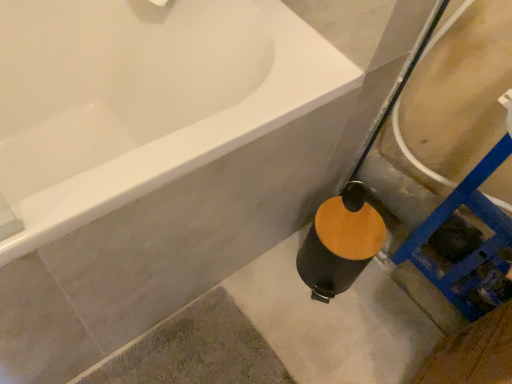
What is the approximate height of white glossy bathtub at upper left?

24.77 inches.

The image size is (512, 384). What do you see at coordinates (142, 99) in the screenshot?
I see `white glossy bathtub at upper left` at bounding box center [142, 99].

Where is `white glossy bathtub at upper left`? This screenshot has height=384, width=512. white glossy bathtub at upper left is located at coordinates 142,99.

You are a GUI agent. You are given a task and a screenshot of the screen. Output one action in this format:
    pyautogui.click(x=<x>, y=<y>)
    Task: Click on the white glossy bathtub at upper left
    The width and height of the screenshot is (512, 384).
    Given the screenshot: What is the action you would take?
    pyautogui.click(x=142, y=99)